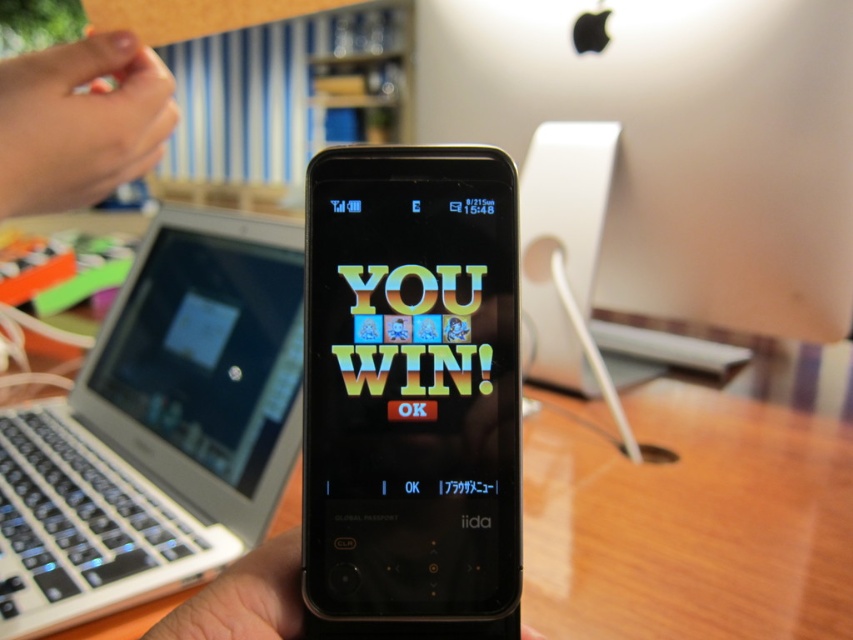
You are a photographer adjusting your camera settings to capture the smartphone in focus. Considering the white plastic laptop at left and the pink matte fingernail at upper left, which object should you ensure is in focus to keep the smartphone sharp?

To keep the smartphone sharp, focus on the white plastic laptop at left because it is positioned under the pink matte fingernail at upper left, meaning it is closer to the camera and part of the foreground elements.

You are trying to choose between two phones displayed in a store window. You notice both the black glossy smartphone at center and the black matte phone at center. Which one is taller?

The black glossy smartphone at center is much taller than the black matte phone at center.

You are trying to place both the black glossy smartphone at center and the black matte phone at center on a narrow shelf that can only fit items up to 12 cm in width. Given their widths, which phone should you choose to place on the shelf first to maximize space usage?

The black glossy smartphone at center has a lesser width compared to the black matte phone at center, so you should place the black glossy smartphone at center first to allow the wider black matte phone at center to fit afterward if there is remaining space.